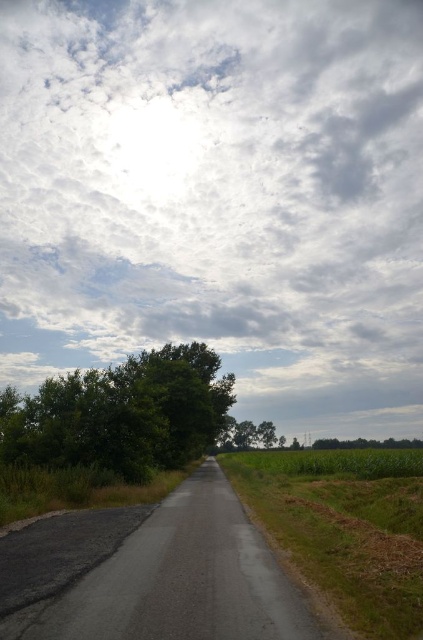
Is green leafy tree at left positioned behind green leafy tree at center?

No, it is in front of green leafy tree at center.

Does green leafy tree at left come in front of green leafy tree at center?

Yes, it is.

The width and height of the screenshot is (423, 640). Identify the location of green leafy tree at left. (121, 413).

Can you confirm if green grassy field at center is positioned below green leafy tree at lower right?

No, green grassy field at center is not below green leafy tree at lower right.

Image resolution: width=423 pixels, height=640 pixels. I want to click on green grassy field at center, so click(x=343, y=532).

Is green leafy tree at lower right positioned before green leafy tree at center?

Yes.

Who is positioned more to the left, green leafy tree at lower right or green leafy tree at center?

green leafy tree at center

Does point (329, 442) come farther from viewer compared to point (274, 440)?

No.

Find the location of a particular element. green leafy tree at lower right is located at coordinates (367, 444).